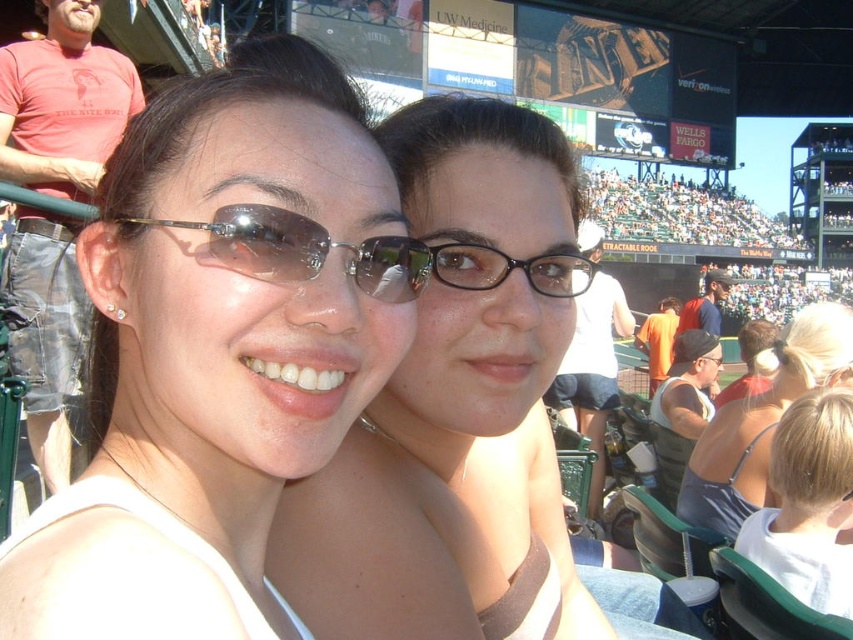
Question: Which object appears farthest from the camera in this image?

Choices:
 (A) matte black glasses at center
 (B) dark blue tank top at center

Answer: (B)

Question: Is pearl earrings at left closer to the viewer compared to black plastic glasses at center?

Choices:
 (A) no
 (B) yes

Answer: (A)

Question: Which object is closer to the camera taking this photo?

Choices:
 (A) blonde hair at lower right
 (B) matte white tank top at center
 (C) matte black glasses at center

Answer: (B)

Question: Which point is closer to the camera?

Choices:
 (A) pearl earrings at left
 (B) matte black glasses at center

Answer: (B)

Question: Is matte white tank top at center to the left of dark blue tank top at center from the viewer's perspective?

Choices:
 (A) yes
 (B) no

Answer: (A)

Question: Is matte white tank top at center further to camera compared to matte black glasses at center?

Choices:
 (A) no
 (B) yes

Answer: (A)